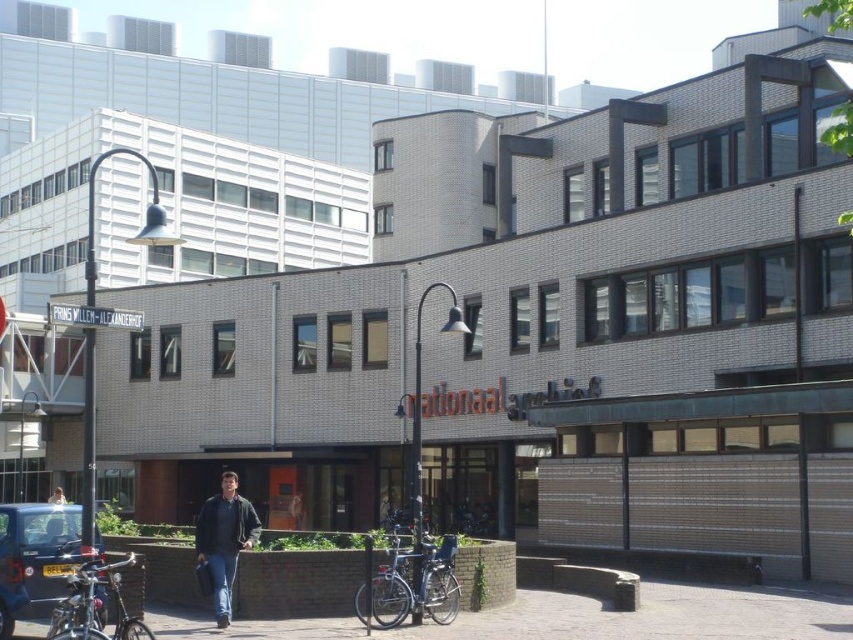
Question: Can you confirm if smooth concrete pavement at lower center is positioned to the right of silver metallic bicycle at center?

Choices:
 (A) no
 (B) yes

Answer: (B)

Question: Which object appears farthest from the camera in this image?

Choices:
 (A) shiny metallic bicycle at lower left
 (B) light blue jeans at center
 (C) metallic silver car at lower left

Answer: (B)

Question: Does dark blue jeans at center come in front of light blue jeans at center?

Choices:
 (A) yes
 (B) no

Answer: (A)

Question: Which point appears farthest from the camera in this image?

Choices:
 (A) (61, 497)
 (B) (128, 628)

Answer: (A)

Question: Does metallic silver car at lower left come behind shiny metallic bicycle at lower left?

Choices:
 (A) no
 (B) yes

Answer: (B)

Question: Among these objects, which one is nearest to the camera?

Choices:
 (A) metallic silver car at lower left
 (B) shiny metallic bicycle at lower left
 (C) smooth concrete pavement at lower center
 (D) dark blue jeans at center

Answer: (B)